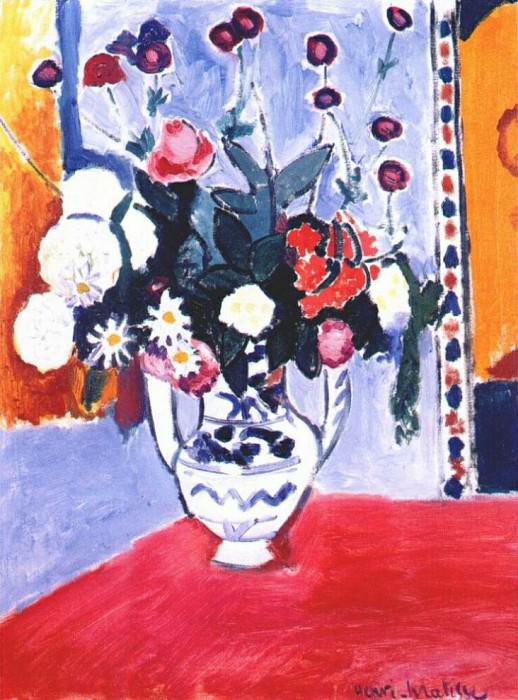
Find any where you'd hold the vase in the picture. Your answer should be formatted as a list of tuples, i.e. [(x1, y1), (x2, y2), ...], where each tuple contains the x and y coordinates of a point satisfying the conditions above.

[(159, 404), (334, 397)]